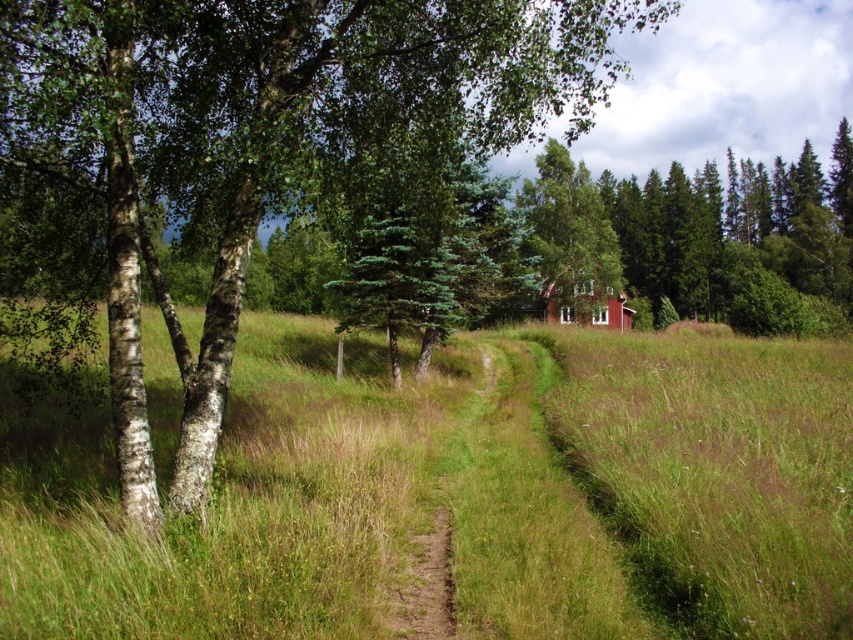
Question: Can you confirm if green matte tree at center is positioned below red wooden cabin at center?

Choices:
 (A) no
 (B) yes

Answer: (A)

Question: Estimate the real-world distances between objects in this image. Which object is closer to the green matte tree at center?

Choices:
 (A) dirt path at center
 (B) red wooden cabin at center

Answer: (A)

Question: Can you confirm if green grassy field at center is positioned to the right of dirt path at center?

Choices:
 (A) no
 (B) yes

Answer: (B)

Question: Which of the following is the farthest from the observer?

Choices:
 (A) green grassy field at center
 (B) red wooden cabin at center

Answer: (B)

Question: Which point is farther to the camera?

Choices:
 (A) green matte tree at center
 (B) dirt path at center
 (C) green grassy field at center
 (D) red wooden cabin at center

Answer: (D)

Question: Is dirt path at center to the right of red wooden cabin at center from the viewer's perspective?

Choices:
 (A) no
 (B) yes

Answer: (A)